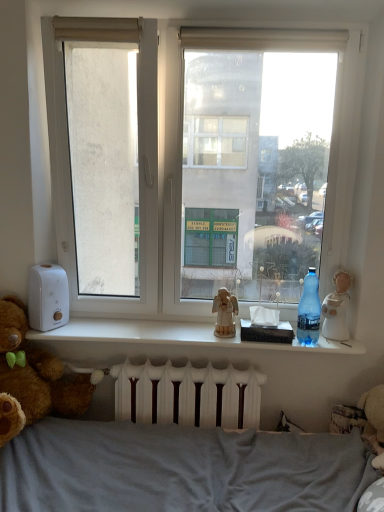
Question: Is brown plush teddy bear at left at the back of white fabric curtain at upper center?

Choices:
 (A) yes
 (B) no

Answer: (B)

Question: From the image's perspective, is white fabric curtain at upper center on top of brown plush teddy bear at left?

Choices:
 (A) yes
 (B) no

Answer: (A)

Question: Is white fabric curtain at upper center not inside brown plush teddy bear at left?

Choices:
 (A) yes
 (B) no

Answer: (A)

Question: Does white fabric curtain at upper center contain brown plush teddy bear at left?

Choices:
 (A) yes
 (B) no

Answer: (B)

Question: Is white fabric curtain at upper center thinner than brown plush teddy bear at left?

Choices:
 (A) yes
 (B) no

Answer: (A)

Question: Is white fabric curtain at upper center bigger than brown plush teddy bear at left?

Choices:
 (A) no
 (B) yes

Answer: (A)

Question: Is the position of white matte window sill at center less distant than that of wooden angel at center, the second figurine from the right?

Choices:
 (A) no
 (B) yes

Answer: (B)

Question: Considering the relative sizes of white matte window sill at center and wooden angel at center, the second figurine from the right, in the image provided, is white matte window sill at center thinner than wooden angel at center, the second figurine from the right,?

Choices:
 (A) no
 (B) yes

Answer: (A)

Question: Is white matte window sill at center beside wooden angel at center, the second figurine from the right?

Choices:
 (A) yes
 (B) no

Answer: (B)

Question: From the image's perspective, is white matte window sill at center on top of wooden angel at center, the second figurine from the right?

Choices:
 (A) no
 (B) yes

Answer: (A)

Question: Can you confirm if white matte window sill at center is shorter than wooden angel at center, the second figurine from the right?

Choices:
 (A) yes
 (B) no

Answer: (A)

Question: Does white matte window sill at center have a greater width compared to wooden angel at center, the second figurine from the right?

Choices:
 (A) no
 (B) yes

Answer: (B)

Question: From a real-world perspective, is blue plastic bottle at right on white ceramic figurine at right, which is the second figurine from left to right?

Choices:
 (A) no
 (B) yes

Answer: (B)